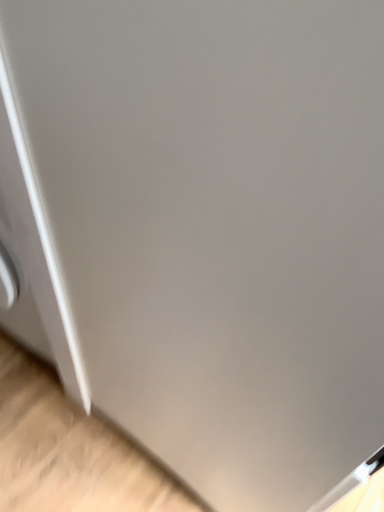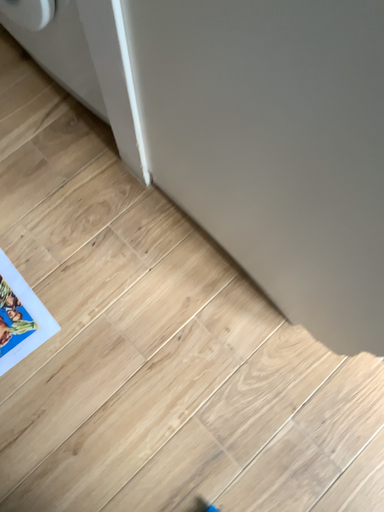
Question: Which way did the camera rotate in the video?

Choices:
 (A) rotated left
 (B) rotated right

Answer: (A)